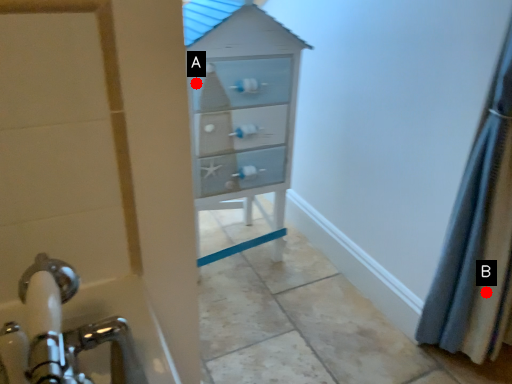
Question: Two points are circled on the image, labeled by A and B beside each circle. Which point is closer to the camera taking this photo?

Choices:
 (A) A is closer
 (B) B is closer

Answer: (B)